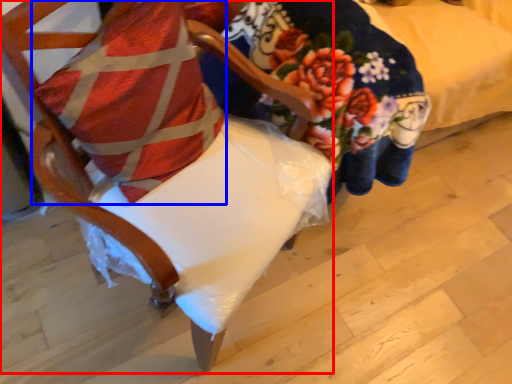
Question: Which object appears farthest to the camera in this image, chair (highlighted by a red box) or pillow (highlighted by a blue box)?

Choices:
 (A) chair
 (B) pillow

Answer: (B)